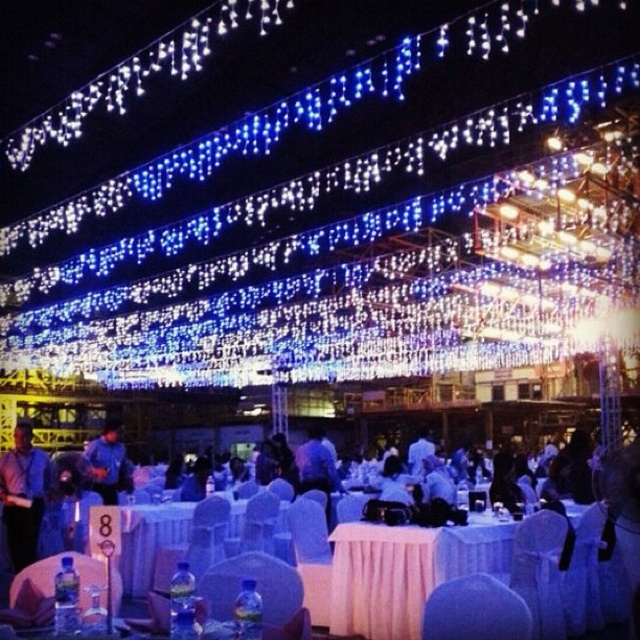
Question: Does blue fabric shirt at center have a greater width compared to white fabric shirt at center?

Choices:
 (A) no
 (B) yes

Answer: (B)

Question: Which point is closer to the camera?

Choices:
 (A) white fabric shirt at center
 (B) dark blue shirt at left

Answer: (A)

Question: Can you confirm if white satin table at center is positioned above blue fabric shirt at center?

Choices:
 (A) yes
 (B) no

Answer: (A)

Question: Which point is farther to the camera?

Choices:
 (A) white fabric shirt at center
 (B) white satin table at center
 (C) blue fabric shirt at center

Answer: (C)

Question: Among these points, which one is farthest from the camera?

Choices:
 (A) (112, 483)
 (B) (10, 554)

Answer: (A)

Question: Does blue fabric shirt at center have a greater width compared to white fabric shirt at center?

Choices:
 (A) yes
 (B) no

Answer: (A)